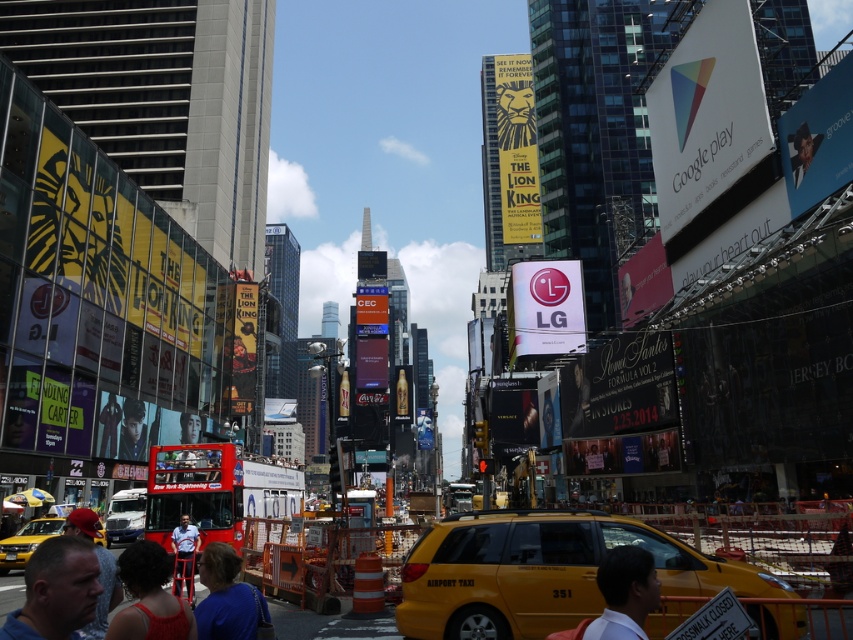
Question: Which of the following is the closest to the observer?

Choices:
 (A) (45, 524)
 (B) (567, 637)
 (C) (173, 625)

Answer: (C)

Question: Is red cap at lower left positioned in front of yellow matte taxi at lower left?

Choices:
 (A) no
 (B) yes

Answer: (B)

Question: Can you confirm if yellow matte taxi at center is wider than matte red dress at lower left?

Choices:
 (A) yes
 (B) no

Answer: (A)

Question: Is white glossy lg sign at center further to the viewer compared to white matte shirt at lower center?

Choices:
 (A) no
 (B) yes

Answer: (B)

Question: Which of these objects is positioned closest to the white matte shirt at lower center?

Choices:
 (A) yellow matte taxi at center
 (B) blue shirt at lower left
 (C) white shirt at center

Answer: (A)

Question: Which object is closer to the camera taking this photo?

Choices:
 (A) blue fabric shirt at lower center
 (B) white shirt at center

Answer: (A)